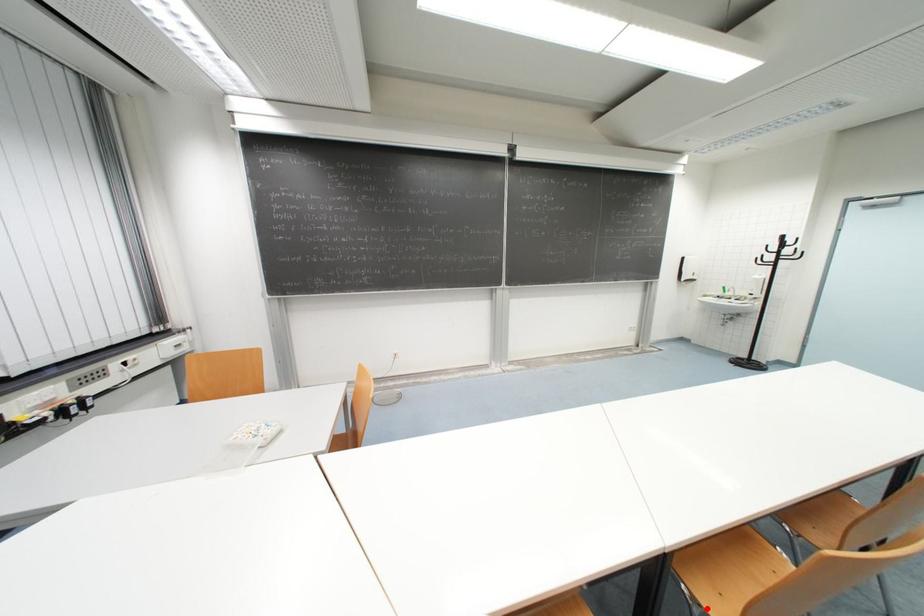
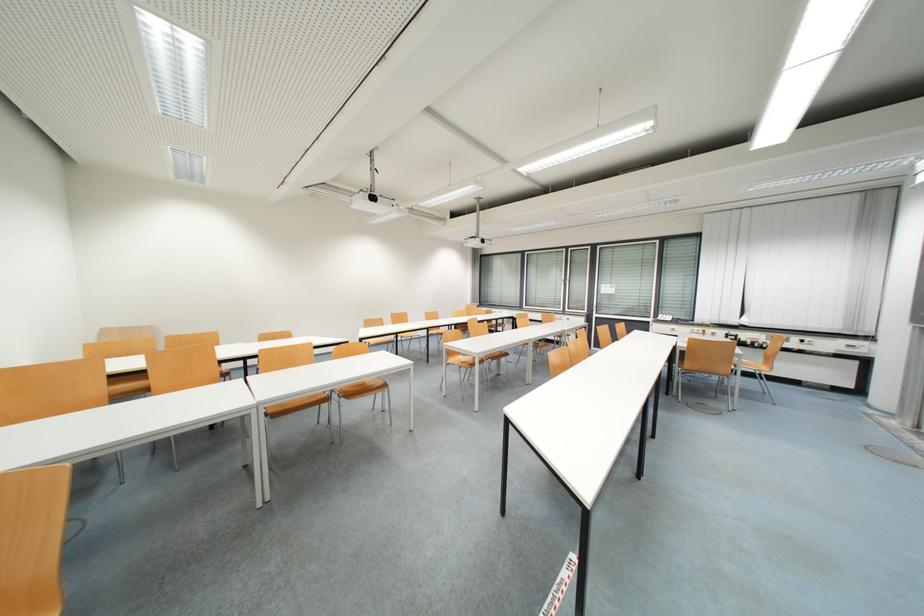
Question: I am providing you with two images of the same scene from different viewpoints. A red point is marked on the first image. Can you still see the location of the red point in image 2?

Choices:
 (A) Yes
 (B) No

Answer: (B)